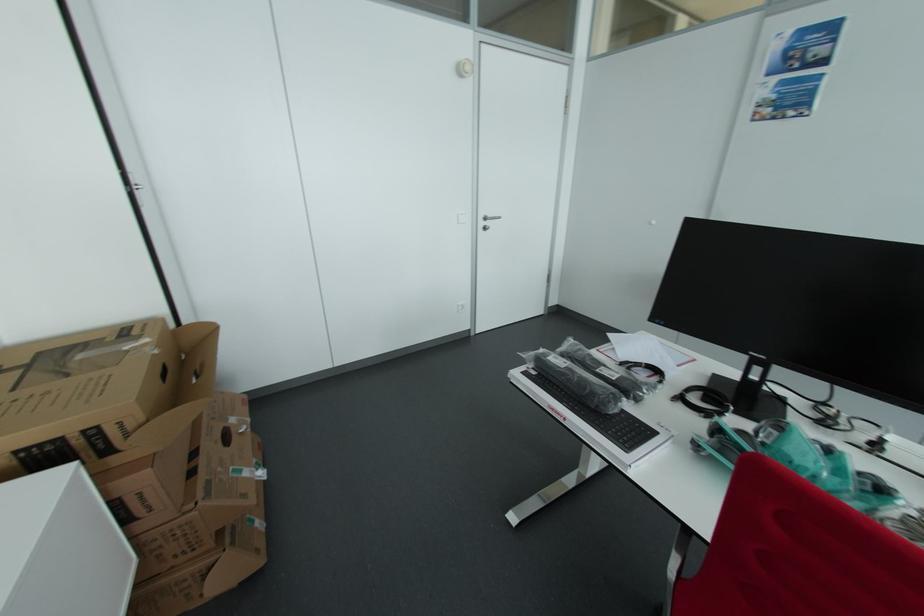
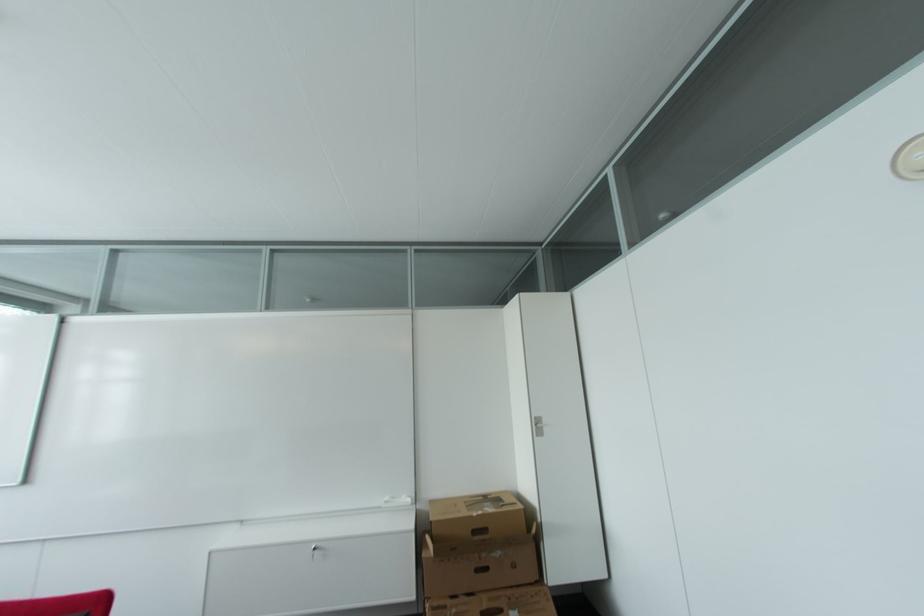
The point at (211, 485) is marked in the first image. Where is the corresponding point in the second image?

(448, 609)